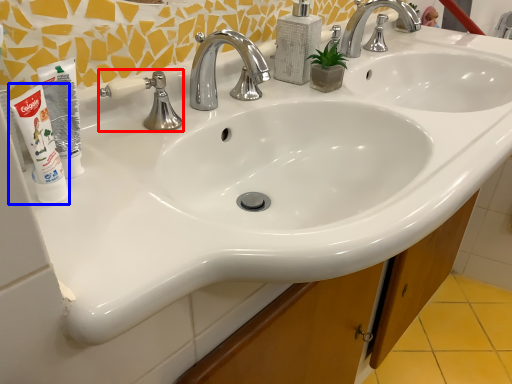
Question: Which of the following is the closest to the observer, plumbing fixture (highlighted by a red box) or shaving cream (highlighted by a blue box)?

Choices:
 (A) plumbing fixture
 (B) shaving cream

Answer: (B)